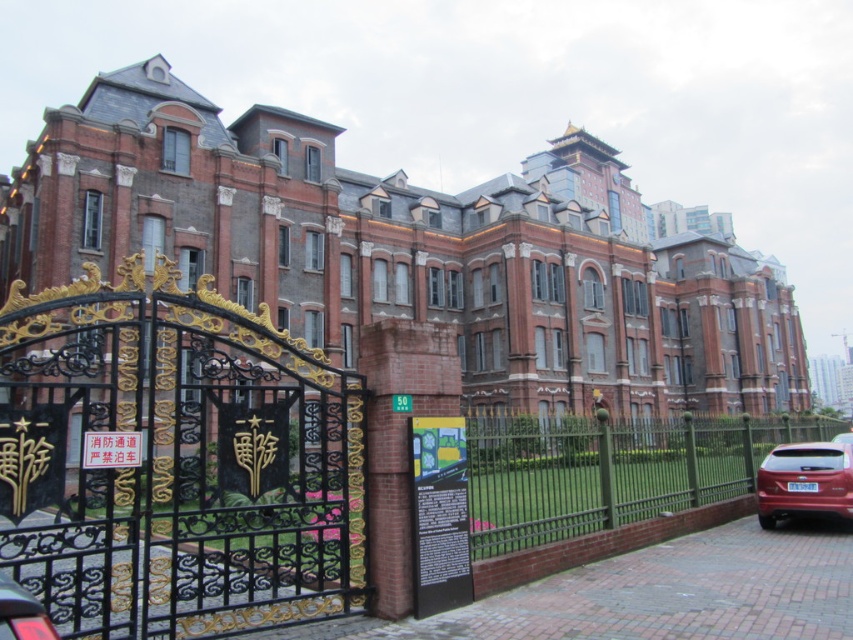
Can you confirm if black wrought iron gate at left is bigger than shiny red suv at right?

Yes, black wrought iron gate at left is bigger than shiny red suv at right.

Who is positioned more to the left, black wrought iron gate at left or shiny red suv at right?

Positioned to the left is black wrought iron gate at left.

Does point (247, 600) lie behind point (822, 490)?

No.

This screenshot has height=640, width=853. I want to click on black wrought iron gate at left, so click(173, 461).

Is black wrought iron gate at left below green metal fence at right?

No.

What do you see at coordinates (173, 461) in the screenshot? I see `black wrought iron gate at left` at bounding box center [173, 461].

Locate an element on the screen. The height and width of the screenshot is (640, 853). black wrought iron gate at left is located at coordinates (173, 461).

Does green metal fence at right have a lesser width compared to shiny red suv at right?

In fact, green metal fence at right might be wider than shiny red suv at right.

Is green metal fence at right to the right of shiny red suv at right from the viewer's perspective?

Incorrect, green metal fence at right is not on the right side of shiny red suv at right.

Is point (554, 531) closer to camera compared to point (843, 488)?

That is True.

Where is `green metal fence at right`? green metal fence at right is located at coordinates click(x=608, y=468).